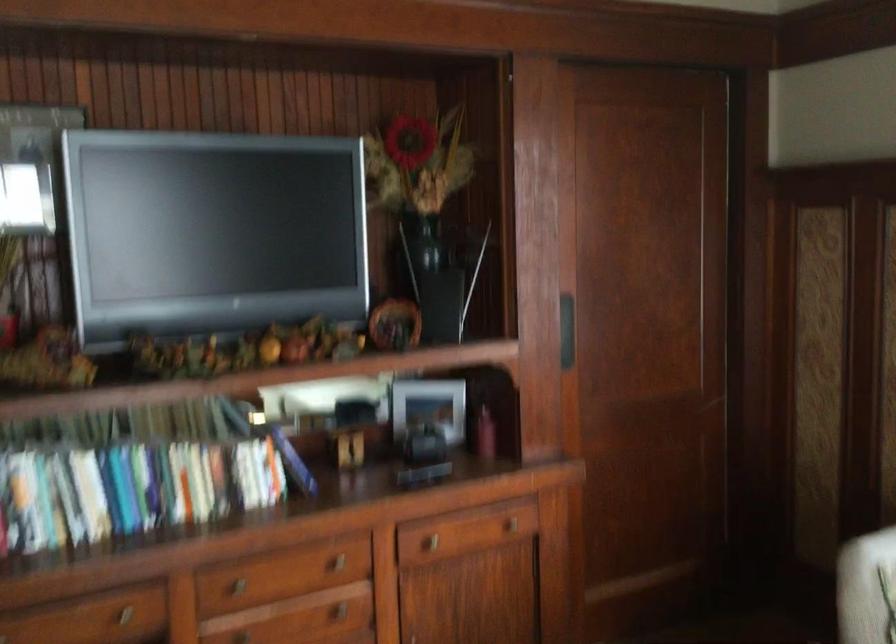
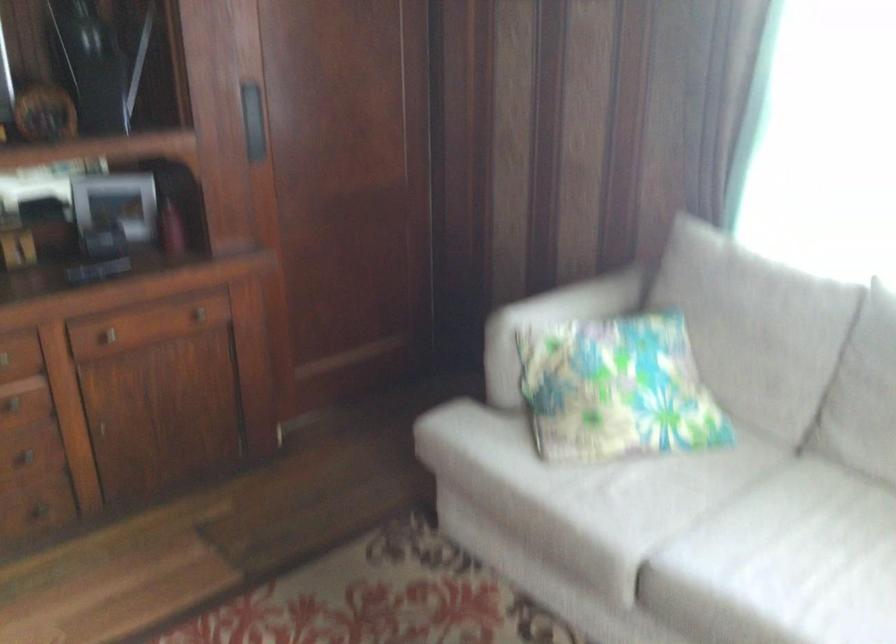
Question: The images are taken continuously from a first-person perspective. In which direction is your viewpoint rotating?

Choices:
 (A) Left
 (B) Right
 (C) Up
 (D) Down

Answer: (B)